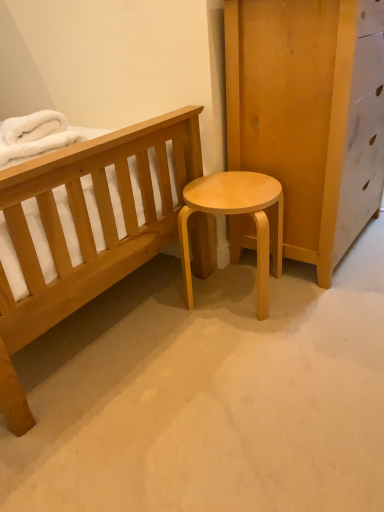
Where is `white fluffy blanket at upper left`? This screenshot has height=512, width=384. white fluffy blanket at upper left is located at coordinates (34, 135).

What do you see at coordinates (34, 135) in the screenshot? Image resolution: width=384 pixels, height=512 pixels. I see `white fluffy blanket at upper left` at bounding box center [34, 135].

Where is `light wood/matte stool at center`? The width and height of the screenshot is (384, 512). light wood/matte stool at center is located at coordinates (236, 214).

Describe the element at coordinates (236, 214) in the screenshot. I see `light wood/matte stool at center` at that location.

Locate an element on the screen. white fluffy blanket at upper left is located at coordinates (34, 135).

Is light wood/matte stool at center at the left side of white fluffy blanket at upper left?

No.

Which object is further away from the camera taking this photo, light wood/matte stool at center or white fluffy blanket at upper left?

light wood/matte stool at center is more distant.

Which is behind, point (273, 254) or point (12, 128)?

The point (273, 254) is behind.

From the image's perspective, relative to white fluffy blanket at upper left, is light wood/matte stool at center above or below?

Based on their image positions, light wood/matte stool at center is located beneath white fluffy blanket at upper left.

From a real-world perspective, does light wood/matte stool at center stand above white fluffy blanket at upper left?

No.

From the picture: Is light wood/matte stool at center wider or thinner than white fluffy blanket at upper left?

Considering their sizes, light wood/matte stool at center looks broader than white fluffy blanket at upper left.

Consider the image. In terms of height, does light wood/matte stool at center look taller or shorter compared to white fluffy blanket at upper left?

In the image, light wood/matte stool at center appears to be taller than white fluffy blanket at upper left.

Considering the relative sizes of light wood/matte stool at center and white fluffy blanket at upper left in the image provided, is light wood/matte stool at center bigger than white fluffy blanket at upper left?

Indeed, light wood/matte stool at center has a larger size compared to white fluffy blanket at upper left.

Is light wood/matte stool at center outside of white fluffy blanket at upper left?

Indeed, light wood/matte stool at center is completely outside white fluffy blanket at upper left.

Are light wood/matte stool at center and white fluffy blanket at upper left far apart?

Actually, light wood/matte stool at center and white fluffy blanket at upper left are a little close together.

In the scene shown: Does light wood/matte stool at center turn towards white fluffy blanket at upper left?

No, light wood/matte stool at center is not aimed at white fluffy blanket at upper left.

Looking at this image, what's the angular difference between light wood/matte stool at center and white fluffy blanket at upper left's facing directions?

light wood/matte stool at center and white fluffy blanket at upper left are facing 51.2 degrees away from each other.

How distant is light wood/matte stool at center from white fluffy blanket at upper left?

The distance of light wood/matte stool at center from white fluffy blanket at upper left is 57.41 centimeters.

Find the location of `stool located behind the white fluffy blanket at upper left`. stool located behind the white fluffy blanket at upper left is located at coordinates (236, 214).

Considering the positions of objects white fluffy blanket at upper left and light wood/matte stool at center in the image provided, who is more to the right, white fluffy blanket at upper left or light wood/matte stool at center?

light wood/matte stool at center.

Which object is closer to the camera, white fluffy blanket at upper left or light wood/matte stool at center?

white fluffy blanket at upper left.

Which is less distant, (41, 144) or (260, 219)?

Point (41, 144).

From the image's perspective, which is below, white fluffy blanket at upper left or light wood/matte stool at center?

light wood/matte stool at center.

From a real-world perspective, relative to light wood/matte stool at center, is white fluffy blanket at upper left vertically above or below?

Clearly, from a real-world perspective, white fluffy blanket at upper left is above light wood/matte stool at center.

Considering the sizes of objects white fluffy blanket at upper left and light wood/matte stool at center in the image provided, who is wider, white fluffy blanket at upper left or light wood/matte stool at center?

light wood/matte stool at center.

Which of these two, white fluffy blanket at upper left or light wood/matte stool at center, stands shorter?

white fluffy blanket at upper left.

Which of these two, white fluffy blanket at upper left or light wood/matte stool at center, is smaller?

white fluffy blanket at upper left.

Would you say white fluffy blanket at upper left is inside or outside light wood/matte stool at center?

white fluffy blanket at upper left is outside light wood/matte stool at center.

Is white fluffy blanket at upper left positioned far away from light wood/matte stool at center?

No, white fluffy blanket at upper left is in close proximity to light wood/matte stool at center.

Is white fluffy blanket at upper left aimed at light wood/matte stool at center?

No, white fluffy blanket at upper left is not oriented towards light wood/matte stool at center.

Image resolution: width=384 pixels, height=512 pixels. I want to click on stool that appears below the white fluffy blanket at upper left (from a real-world perspective), so click(x=236, y=214).

Identify the location of stool that is below the white fluffy blanket at upper left (from the image's perspective). This screenshot has width=384, height=512. (236, 214).

Find the location of `blanket that is above the light wood/matte stool at center (from the image's perspective)`. blanket that is above the light wood/matte stool at center (from the image's perspective) is located at coordinates (34, 135).